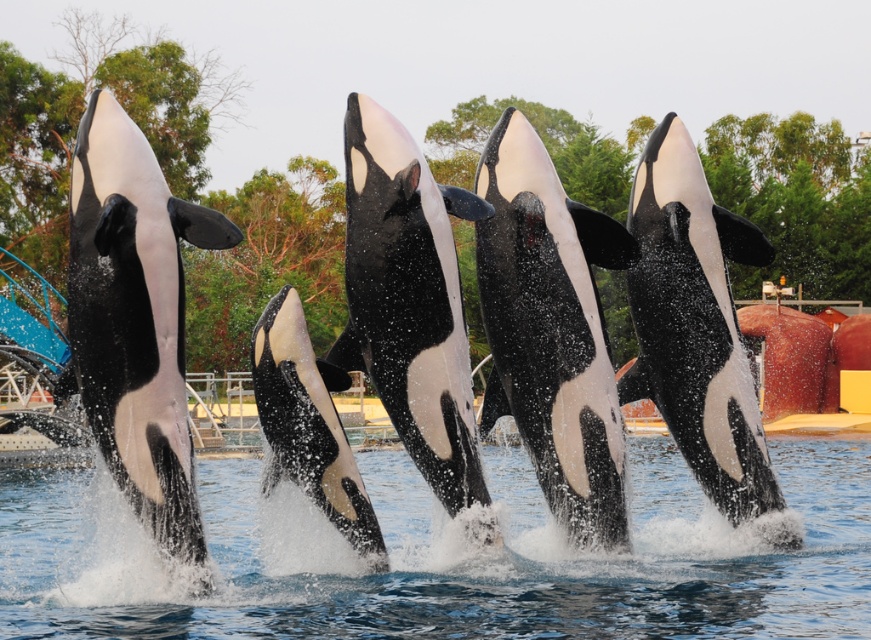
Measure the distance between black and white orca at left and camera.

10.36 meters

Is black and white orca at left bigger than black/white dolphin at center?

Yes.

You are a GUI agent. You are given a task and a screenshot of the screen. Output one action in this format:
    pyautogui.click(x=<x>, y=<y>)
    Task: Click on the black and white orca at left
    
    Given the screenshot: What is the action you would take?
    pyautogui.click(x=134, y=317)

Where is `black and white orca at left`? black and white orca at left is located at coordinates (134, 317).

Can you confirm if black/white textured dolphin at center is taller than black/white dolphin at center?

Yes, black/white textured dolphin at center is taller than black/white dolphin at center.

Who is more distant from viewer, (518, 284) or (334, 376)?

The point (518, 284) is behind.

Is point (609, 513) behind point (392, 292)?

Yes, point (609, 513) is behind point (392, 292).

I want to click on black/white textured dolphin at center, so click(551, 330).

Is black/white dolphin at center shorter than black matte orca at center?

Incorrect, black/white dolphin at center's height does not fall short of black matte orca at center's.

Is point (464, 369) positioned in front of point (356, 508)?

Yes, point (464, 369) is closer to viewer.

At what (x,y) coordinates should I click in order to perform the action: click on black/white dolphin at center. Please return your answer as a coordinate pair (x, y). Looking at the image, I should click on (408, 300).